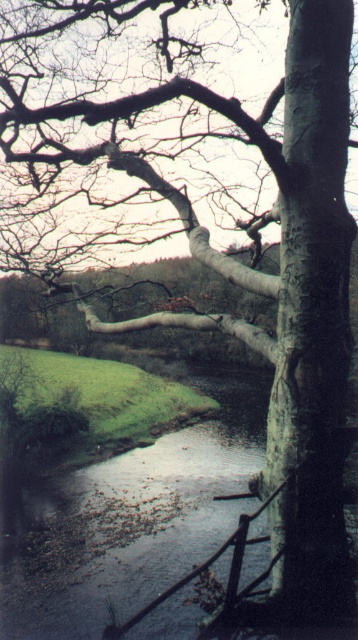
You are standing at the edge of the smooth gray river at center and want to reach the white smooth tree trunk at right. According to the scene, can you walk directly to it along the ground?

The white smooth tree trunk at right is located above the smooth gray river at center, so you cannot walk directly to it along the ground since it is elevated.

You are a painter standing at the edge of the smooth gray river at center, looking towards the white smooth tree trunk at right. Which object is taller from your viewpoint?

The white smooth tree trunk at right is taller than the smooth gray river at center.

You are standing at the edge of the water and see the point marked at coordinates (x=312, y=314). Based on the scene, can you tell me what object this point is located on?

The point marked at coordinates (x=312, y=314) is located on the white smooth tree trunk at right.